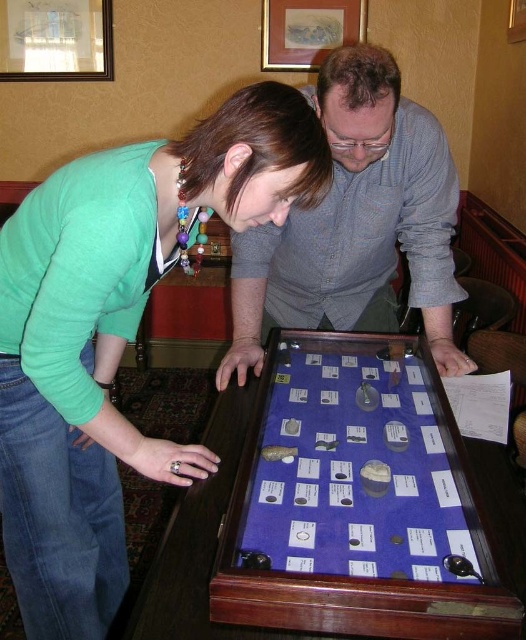
Is blue velvet game at center bigger than gray checkered shirt at center?

No, blue velvet game at center is not bigger than gray checkered shirt at center.

Is blue velvet game at center positioned before gray checkered shirt at center?

That is True.

I want to click on blue velvet game at center, so click(x=353, y=474).

You are a GUI agent. You are given a task and a screenshot of the screen. Output one action in this format:
    pyautogui.click(x=<x>, y=<y>)
    Task: Click on the green matte sweater at center
    Image resolution: width=526 pixels, height=640 pixels.
    Given the screenshot: What is the action you would take?
    point(116,333)

What do you see at coordinates (116, 333) in the screenshot? I see `green matte sweater at center` at bounding box center [116, 333].

Who is more distant from viewer, [14,276] or [156,609]?

The point [14,276] is more distant.

This screenshot has height=640, width=526. I want to click on green matte sweater at center, so click(116, 333).

Can you confirm if green matte sweater at center is thinner than gray checkered shirt at center?

Yes, green matte sweater at center is thinner than gray checkered shirt at center.

Which is above, green matte sweater at center or gray checkered shirt at center?

gray checkered shirt at center is higher up.

Between point (59, 577) and point (271, 268), which one is positioned in front?

Point (59, 577)

Locate an element on the screen. The height and width of the screenshot is (640, 526). green matte sweater at center is located at coordinates (116, 333).